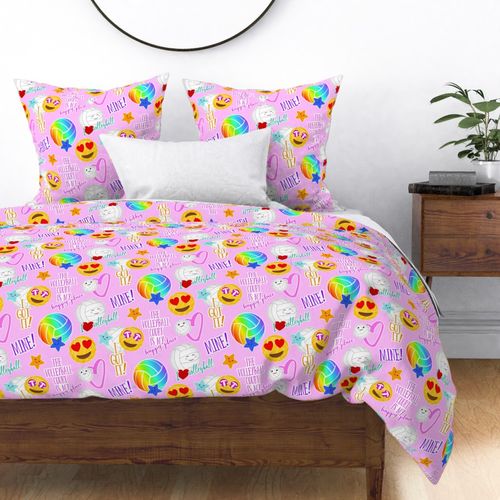
This screenshot has height=500, width=500. I want to click on white pillow, so click(x=194, y=161).